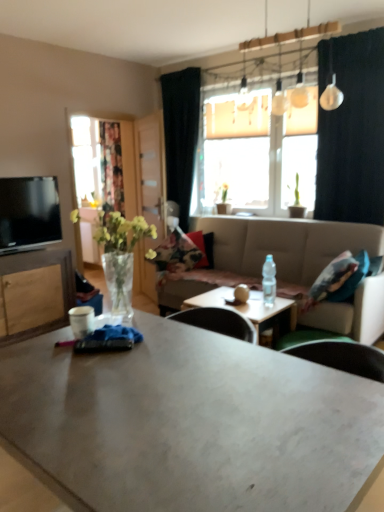
At what (x,y) coordinates should I click in order to perform the action: click on vacant space situated above matte white coffee table at center, which appears as the second coffee table when viewed from the front (from a real-world perspective). Please return your answer as a coordinate pair (x, y). Looking at the image, I should click on (236, 300).